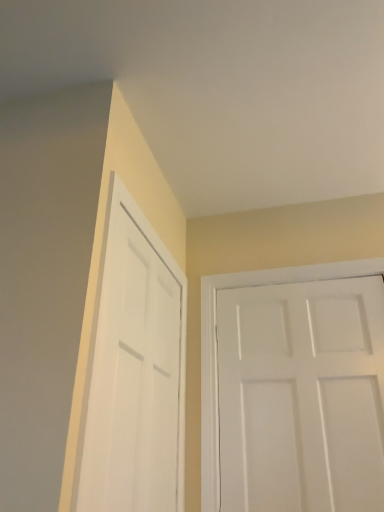
Describe the element at coordinates (302, 396) in the screenshot. I see `white matte door at right, which is counted as the 2th door, starting from the left` at that location.

Where is `white matte door at right, which is the 1th door from right to left`? This screenshot has width=384, height=512. white matte door at right, which is the 1th door from right to left is located at coordinates (302, 396).

In order to face white matte door at left, acting as the 2th door starting from the right, should I rotate leftwards or rightwards?

A 4.726 degree turn to the left will do.

Image resolution: width=384 pixels, height=512 pixels. Describe the element at coordinates (133, 376) in the screenshot. I see `white matte door at left, marked as the 1th door in a left-to-right arrangement` at that location.

What are the coordinates of `white matte door at left, marked as the 1th door in a left-to-right arrangement` in the screenshot? It's located at (133, 376).

How much space does white matte door at left, marked as the 1th door in a left-to-right arrangement, occupy vertically?

The height of white matte door at left, marked as the 1th door in a left-to-right arrangement, is 37.78 inches.

You are a GUI agent. You are given a task and a screenshot of the screen. Output one action in this format:
    pyautogui.click(x=<x>, y=<y>)
    Task: Click on the white matte door at right, which is counted as the 2th door, starting from the left
    Image resolution: width=384 pixels, height=512 pixels.
    Given the screenshot: What is the action you would take?
    pyautogui.click(x=302, y=396)

Between white matte door at left, acting as the 2th door starting from the right, and white matte door at right, which is the 1th door from right to left, which one appears on the right side from the viewer's perspective?

From the viewer's perspective, white matte door at right, which is the 1th door from right to left, appears more on the right side.

Which is behind, white matte door at left, marked as the 1th door in a left-to-right arrangement, or white matte door at right, which is counted as the 2th door, starting from the left?

white matte door at right, which is counted as the 2th door, starting from the left, is more distant.

Which point is more forward, (119, 386) or (231, 471)?

Positioned in front is point (119, 386).

From the image's perspective, is white matte door at left, marked as the 1th door in a left-to-right arrangement, positioned above or below white matte door at right, which is the 1th door from right to left?

Clearly, from the image's perspective, white matte door at left, marked as the 1th door in a left-to-right arrangement, is above white matte door at right, which is the 1th door from right to left.

From a real-world perspective, is white matte door at left, acting as the 2th door starting from the right, positioned over white matte door at right, which is counted as the 2th door, starting from the left, based on gravity?

Yes.

Can you confirm if white matte door at left, acting as the 2th door starting from the right, is wider than white matte door at right, which is the 1th door from right to left?

Incorrect, the width of white matte door at left, acting as the 2th door starting from the right, does not surpass that of white matte door at right, which is the 1th door from right to left.

Is white matte door at left, marked as the 1th door in a left-to-right arrangement, taller or shorter than white matte door at right, which is the 1th door from right to left?

white matte door at left, marked as the 1th door in a left-to-right arrangement, is taller than white matte door at right, which is the 1th door from right to left.

Does white matte door at left, marked as the 1th door in a left-to-right arrangement, have a larger size compared to white matte door at right, which is counted as the 2th door, starting from the left?

Incorrect, white matte door at left, marked as the 1th door in a left-to-right arrangement, is not larger than white matte door at right, which is counted as the 2th door, starting from the left.

Could white matte door at right, which is the 1th door from right to left, be considered to be inside white matte door at left, marked as the 1th door in a left-to-right arrangement?

No.

Can you see white matte door at left, acting as the 2th door starting from the right, touching white matte door at right, which is counted as the 2th door, starting from the left?

white matte door at left, acting as the 2th door starting from the right, is not next to white matte door at right, which is counted as the 2th door, starting from the left, and they're not touching.

Looking at this image, is white matte door at right, which is the 1th door from right to left, at the back of white matte door at left, marked as the 1th door in a left-to-right arrangement?

No.

Can you tell me how much white matte door at left, marked as the 1th door in a left-to-right arrangement, and white matte door at right, which is the 1th door from right to left, differ in facing direction?

The facing directions of white matte door at left, marked as the 1th door in a left-to-right arrangement, and white matte door at right, which is the 1th door from right to left, are 90.2 degrees apart.

Identify the location of door above the white matte door at right, which is counted as the 2th door, starting from the left (from the image's perspective). This screenshot has height=512, width=384. (133, 376).

In the scene shown: Does white matte door at right, which is the 1th door from right to left, appear on the right side of white matte door at left, marked as the 1th door in a left-to-right arrangement?

Yes.

Which object is closer to the camera, white matte door at right, which is counted as the 2th door, starting from the left, or white matte door at left, acting as the 2th door starting from the right?

white matte door at left, acting as the 2th door starting from the right, is in front.

Is point (247, 421) closer or farther from the camera than point (113, 439)?

Point (247, 421) appears to be farther away from the viewer than point (113, 439).

From the image's perspective, does white matte door at right, which is the 1th door from right to left, appear higher than white matte door at left, acting as the 2th door starting from the right?

No, from the image's perspective, white matte door at right, which is the 1th door from right to left, is not on top of white matte door at left, acting as the 2th door starting from the right.

Based on the photo, from a real-world perspective, between white matte door at right, which is the 1th door from right to left, and white matte door at left, acting as the 2th door starting from the right, who is vertically lower?

white matte door at right, which is the 1th door from right to left, from a real-world perspective.

Considering the sizes of white matte door at right, which is the 1th door from right to left, and white matte door at left, acting as the 2th door starting from the right, in the image, is white matte door at right, which is the 1th door from right to left, wider or thinner than white matte door at left, acting as the 2th door starting from the right,?

Answer: In the image, white matte door at right, which is the 1th door from right to left, appears to be wider than white matte door at left, acting as the 2th door starting from the right.

Consider the image. Between white matte door at right, which is counted as the 2th door, starting from the left, and white matte door at left, marked as the 1th door in a left-to-right arrangement, which one has less height?

With less height is white matte door at right, which is counted as the 2th door, starting from the left.

Considering the sizes of white matte door at right, which is the 1th door from right to left, and white matte door at left, acting as the 2th door starting from the right, in the image, is white matte door at right, which is the 1th door from right to left, bigger or smaller than white matte door at left, acting as the 2th door starting from the right,?

In the image, white matte door at right, which is the 1th door from right to left, appears to be larger than white matte door at left, acting as the 2th door starting from the right.

Is white matte door at left, acting as the 2th door starting from the right, surrounded by white matte door at right, which is the 1th door from right to left?

No.

Is white matte door at right, which is counted as the 2th door, starting from the left, positioned far away from white matte door at left, acting as the 2th door starting from the right?

Actually, white matte door at right, which is counted as the 2th door, starting from the left, and white matte door at left, acting as the 2th door starting from the right, are a little close together.

Does white matte door at right, which is counted as the 2th door, starting from the left, turn towards white matte door at left, acting as the 2th door starting from the right?

Yes.

Where is `door below the white matte door at left, marked as the 1th door in a left-to-right arrangement (from the image's perspective)`? door below the white matte door at left, marked as the 1th door in a left-to-right arrangement (from the image's perspective) is located at coordinates (302, 396).

Where is `door that is above the white matte door at right, which is counted as the 2th door, starting from the left (from the image's perspective)`? door that is above the white matte door at right, which is counted as the 2th door, starting from the left (from the image's perspective) is located at coordinates (133, 376).

Where is `door to the left of white matte door at right, which is counted as the 2th door, starting from the left`? The width and height of the screenshot is (384, 512). door to the left of white matte door at right, which is counted as the 2th door, starting from the left is located at coordinates (133, 376).